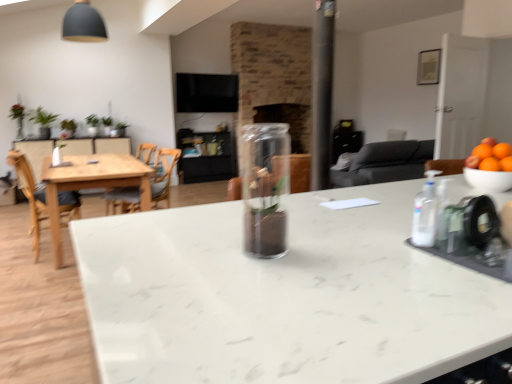
The image size is (512, 384). In order to click on vacant area that is in front of transparent plastic bottle at right in this screenshot , I will do `click(438, 262)`.